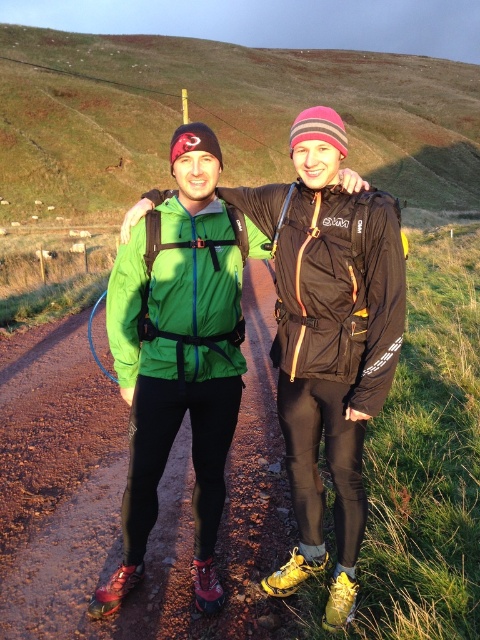
You are a photographer trying to capture both the green fabric jacket at upper center and the green matte jacket at center in a single shot. Since you want to emphasize the size difference between them, which jacket should you position closer to the camera?

To emphasize the size difference between the green fabric jacket at upper center and the green matte jacket at center, you should position the green fabric jacket at upper center closer to the camera since it is larger in size than the green matte jacket at center.

Based on the coordinates provided, which object is located at point [220,116] in the image?

The point [220,116] corresponds to the green fabric jacket at upper center.